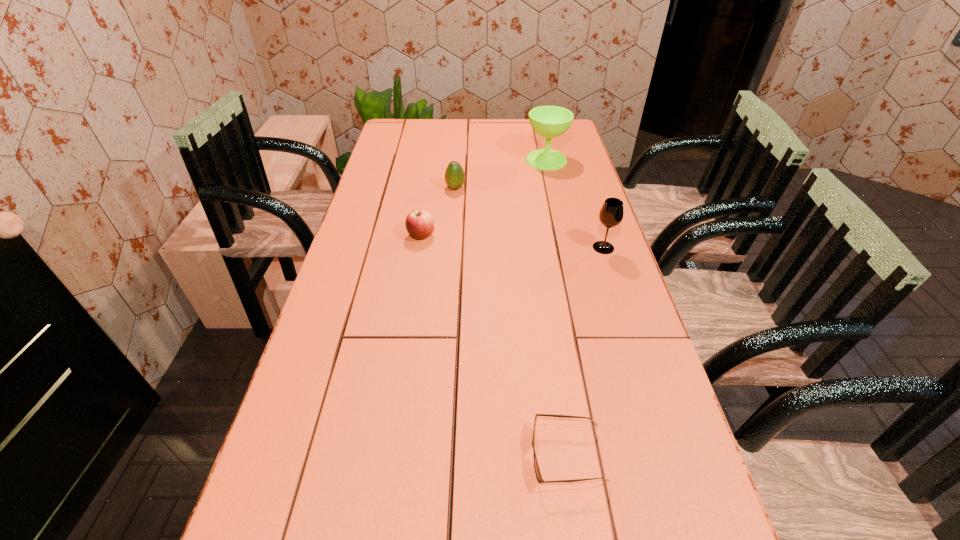
Locate an element on the screen. The image size is (960, 540). free area in between the farthest object and the sunglasses is located at coordinates (557, 308).

What are the coordinates of `free point between the shortest object and the farthest object` in the screenshot? It's located at (557, 308).

In order to click on vacant space that's between the farthest object and the apple in this screenshot , I will do `click(484, 198)`.

You are a GUI agent. You are given a task and a screenshot of the screen. Output one action in this format:
    pyautogui.click(x=<x>, y=<y>)
    Task: Click on the free space between the farthest object and the nearer wineglass
    
    Given the screenshot: What is the action you would take?
    pyautogui.click(x=575, y=204)

Where is `vacant space that is in between the sunglasses and the avocado`? vacant space that is in between the sunglasses and the avocado is located at coordinates (512, 322).

Locate an element on the screen. This screenshot has height=540, width=960. unoccupied area between the fourth nearest object and the nearer wineglass is located at coordinates (529, 218).

Identify the location of unoccupied position between the avocado and the nearer wineglass. The image size is (960, 540). (529, 218).

Locate an element on the screen. The height and width of the screenshot is (540, 960). vacant area that lies between the nearer wineglass and the apple is located at coordinates (513, 241).

Find the location of a particular element. The image size is (960, 540). vacant space that is in between the nearer wineglass and the leftmost object is located at coordinates pos(513,241).

In order to click on free area in between the fourth nearest object and the fourth tallest object in this screenshot , I will do `click(438, 212)`.